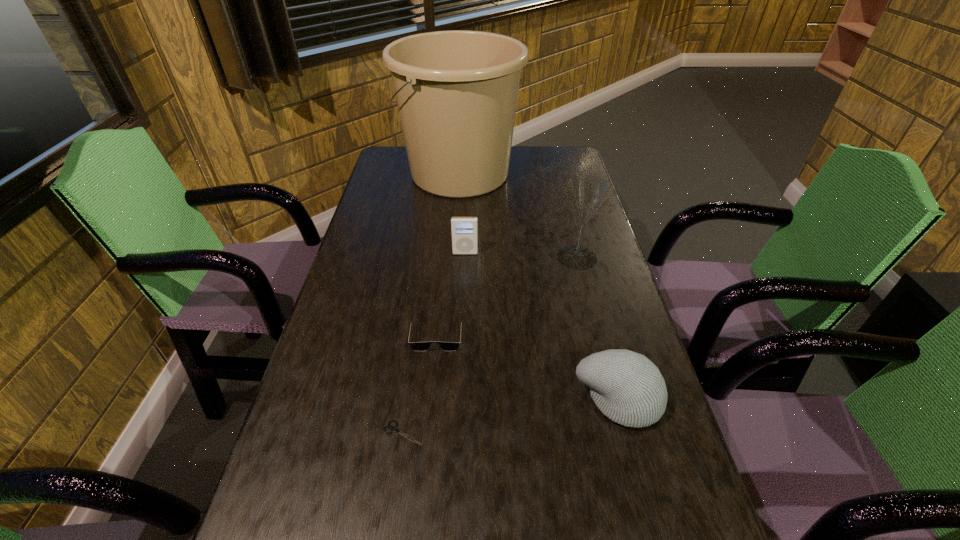
In the image, there is a desktop. Identify the location of vacant space at the left edge. This screenshot has width=960, height=540. (263, 521).

The image size is (960, 540). I want to click on vacant space at the right edge, so click(x=585, y=306).

Find the location of `free space between the sunglasses and the shortest object`. free space between the sunglasses and the shortest object is located at coordinates (420, 383).

Identify the location of free space between the tallest object and the flute glass. (518, 215).

Where is `free space between the beanie and the iPod`? free space between the beanie and the iPod is located at coordinates (541, 326).

Locate an element on the screen. This screenshot has height=540, width=960. vacant region between the beanie and the shears is located at coordinates (511, 416).

Identify the location of free space that is in between the flute glass and the shortest object. This screenshot has height=540, width=960. pos(490,345).

At what (x,y) coordinates should I click in order to perform the action: click on free space between the sunglasses and the shortest object. Please return your answer as a coordinate pair (x, y). Looking at the image, I should click on (420, 383).

Identify the location of free space between the beanie and the fifth shortest object. This screenshot has height=540, width=960. (597, 328).

Where is `empty location between the beanie and the second shortest object`? empty location between the beanie and the second shortest object is located at coordinates (527, 366).